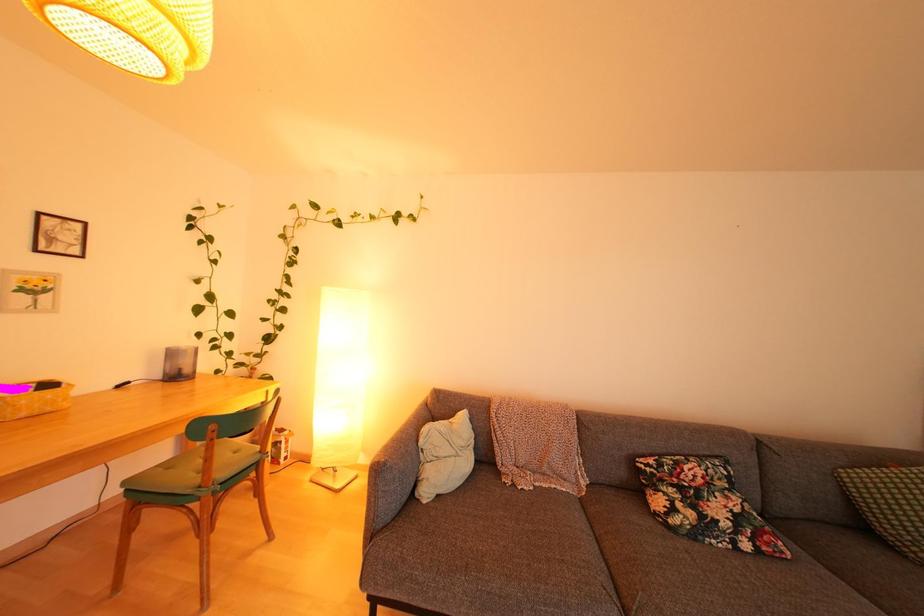
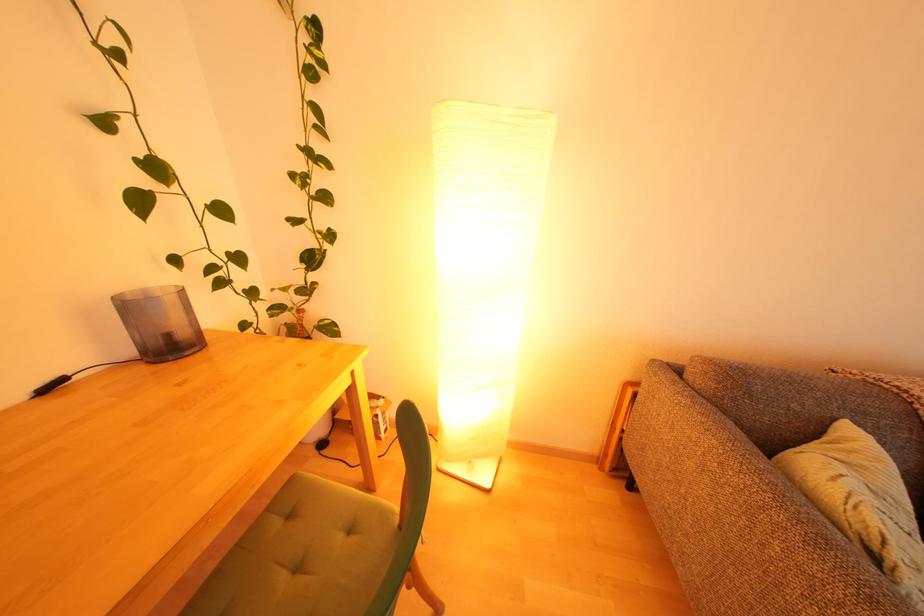
Which direction would the cameraman need to move to produce the second image?

The cameraman walked toward left, forward.